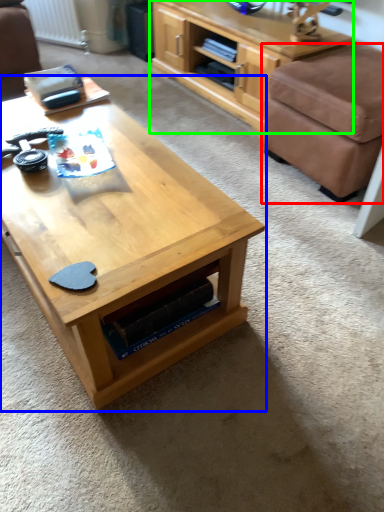
Question: Based on their relative distances, which object is farther from stool (highlighted by a red box)? Choose from coffee table (highlighted by a blue box) and shelf (highlighted by a green box).

Choices:
 (A) coffee table
 (B) shelf

Answer: (A)